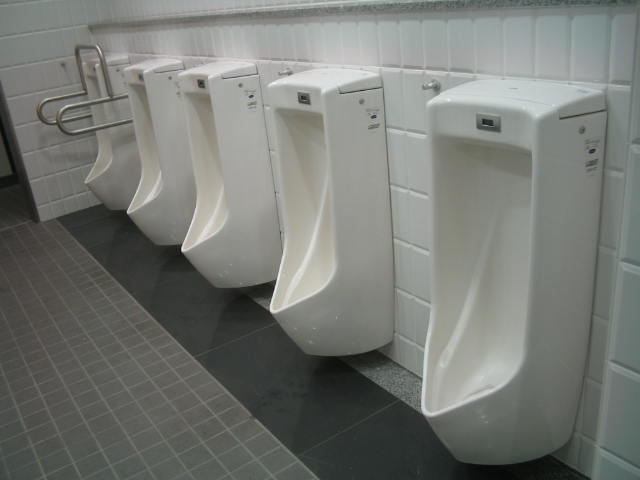
Identify the location of urinals. The image size is (640, 480). (104, 168), (156, 172), (220, 175), (342, 200), (548, 275).